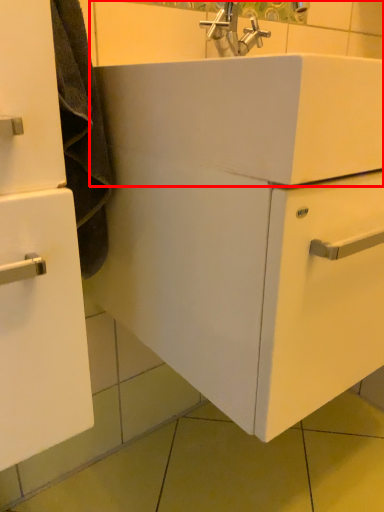
Question: From the image's perspective, where is sink (annotated by the red box) located in relation to bathroom cabinet in the image?

Choices:
 (A) below
 (B) above

Answer: (B)